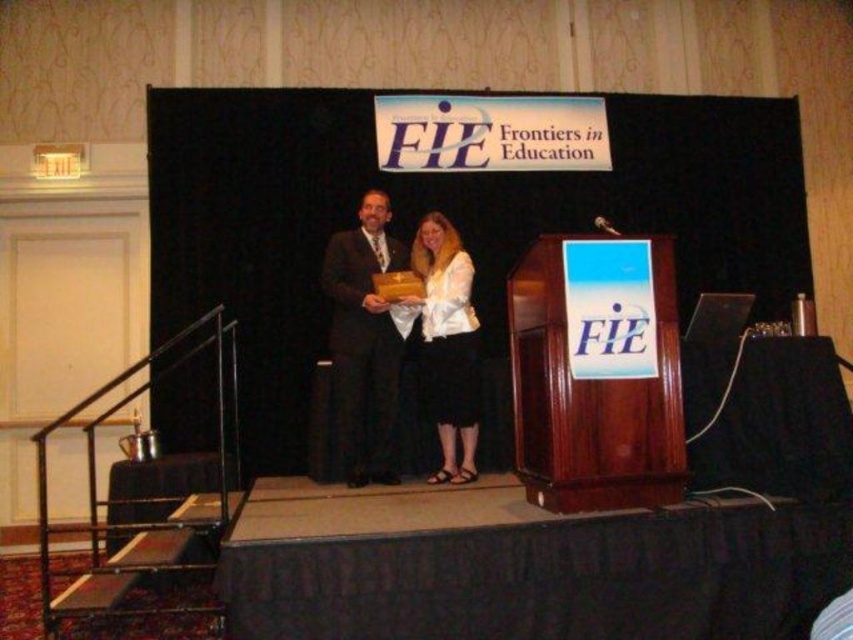
Does matte black suit at center have a greater height compared to matte white blouse at center?

Yes.

Can you confirm if matte black suit at center is positioned to the right of matte white blouse at center?

No, matte black suit at center is not to the right of matte white blouse at center.

Who is more forward, (345, 244) or (415, 252)?

Point (345, 244) is in front.

Identify the location of matte black suit at center. (364, 342).